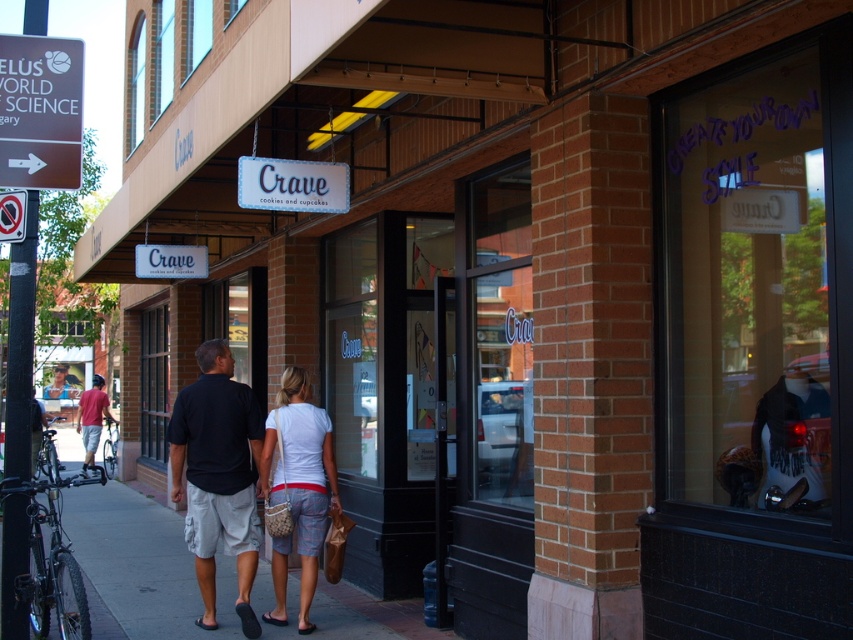
Question: Is smooth concrete sidewalk at center further to the viewer compared to brushed metal sign at upper left?

Choices:
 (A) yes
 (B) no

Answer: (A)

Question: Which of the following is the farthest from the observer?

Choices:
 (A) (108, 524)
 (B) (231, 476)
 (C) (264, 467)

Answer: (A)

Question: Which of these objects is positioned closest to the black cotton shirt at center?

Choices:
 (A) matte red shirt at left
 (B) white woven purse at center
 (C) brushed metal sign at upper left

Answer: (B)

Question: Estimate the real-world distances between objects in this image. Which object is farther from the smooth concrete sidewalk at center?

Choices:
 (A) black cotton shirt at center
 (B) brushed metal sign at upper left
 (C) matte red shirt at left

Answer: (C)

Question: Does black cotton shirt at center appear under matte red shirt at left?

Choices:
 (A) yes
 (B) no

Answer: (B)

Question: Does smooth concrete sidewalk at center appear on the right side of white woven purse at center?

Choices:
 (A) no
 (B) yes

Answer: (A)